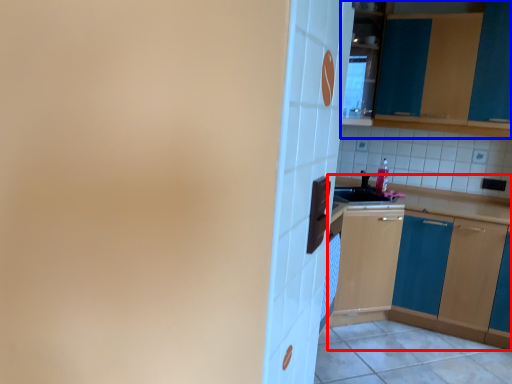
Question: Which object appears closest to the camera in this image, cabinetry (highlighted by a red box) or cabinetry (highlighted by a blue box)?

Choices:
 (A) cabinetry
 (B) cabinetry

Answer: (A)